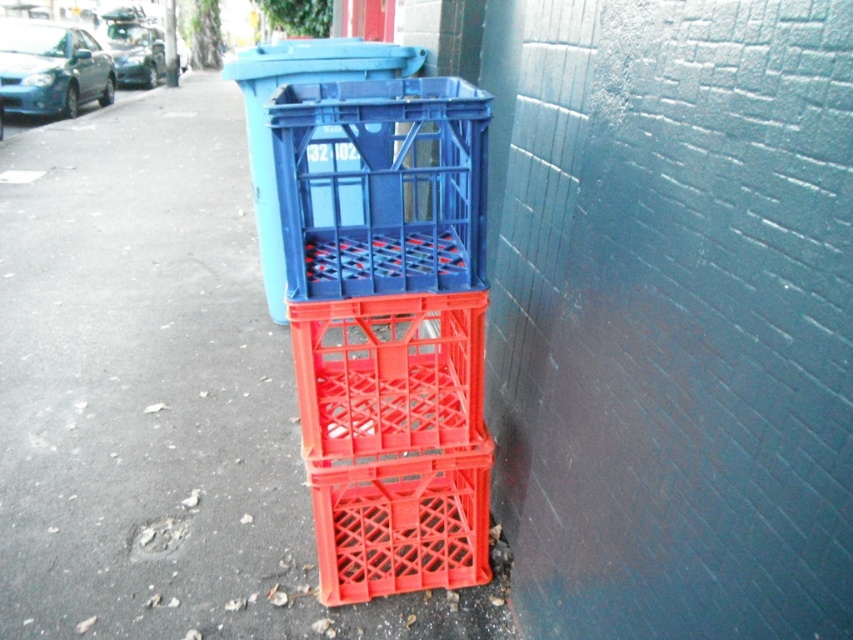
You are standing at the origin point in the image. You see two points labeled as point 1 at coordinates point (x=161, y=148) and point 2 at coordinates point (x=339, y=42). Which point is closer to you?

Point 2 at coordinates point (x=339, y=42) is closer to you because it is in front of point 1 at coordinates point (x=161, y=148).